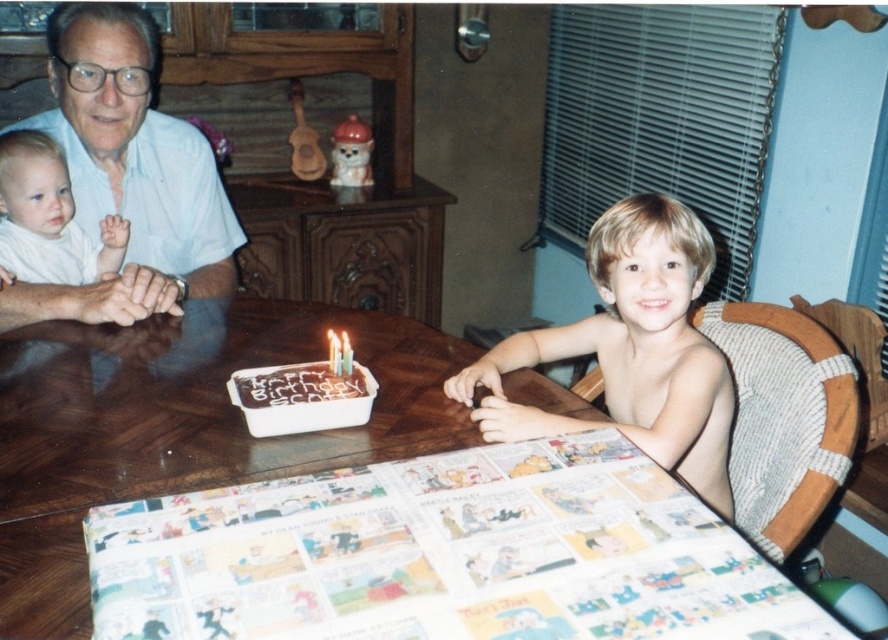
Is chocolate frosted cake at center bigger than white wax candle at center?

Indeed, chocolate frosted cake at center has a larger size compared to white wax candle at center.

Who is taller, chocolate frosted cake at center or white wax candle at center?

Standing taller between the two is chocolate frosted cake at center.

What do you see at coordinates (303, 396) in the screenshot? I see `chocolate frosted cake at center` at bounding box center [303, 396].

Locate an element on the screen. This screenshot has height=640, width=888. chocolate frosted cake at center is located at coordinates (303, 396).

Can you confirm if blonde hair at upper right is positioned above white wax candle at center?

Indeed, blonde hair at upper right is positioned over white wax candle at center.

Which is above, blonde hair at upper right or white wax candle at center?

blonde hair at upper right is higher up.

The width and height of the screenshot is (888, 640). Identify the location of blonde hair at upper right. (631, 349).

Who is taller, blonde hair at upper right or white soft baby at upper left?

Standing taller between the two is blonde hair at upper right.

Does point (670, 221) lie behind point (67, 182)?

No, it is not.

Who is more distant from viewer, (668, 349) or (17, 275)?

Point (17, 275)

Identify the location of blonde hair at upper right. The height and width of the screenshot is (640, 888). (631, 349).